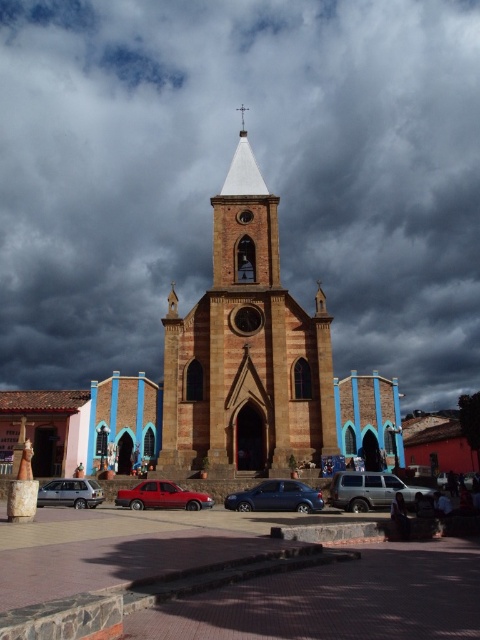
You are a delivery driver who needs to park your metallic blue car at center in the church plaza. The brick pavement at center has a height restriction sign stating vehicles cannot exceed a certain height. Based on the scene, can your car safely park there without hitting the height limit?

The brick pavement at center is taller than the metallic blue car at center, so the car can park there as it is shorter than the pavement height limit.

You are driving a delivery van that is 6 meters long and need to park between the matte red sedan at center and the matte silver suv at lower left. Is there enough space for your van between them?

The distance between the matte red sedan at center and the matte silver suv at lower left is 6.88 meters. Since your van is 6 meters long, there is enough space to park between them as the distance is greater than the van length.

You are a photographer planning to capture the church and its surroundings. You want to ensure that both the dark cloudy sky at upper center and the brick pavement at center are visible in your shot. Based on their sizes, which one should you prioritize framing closer to the edge of the photo?

The dark cloudy sky at upper center is bigger than the brick pavement at center, so you should prioritize framing the brick pavement at center closer to the edge of the photo to accommodate the larger sky area.